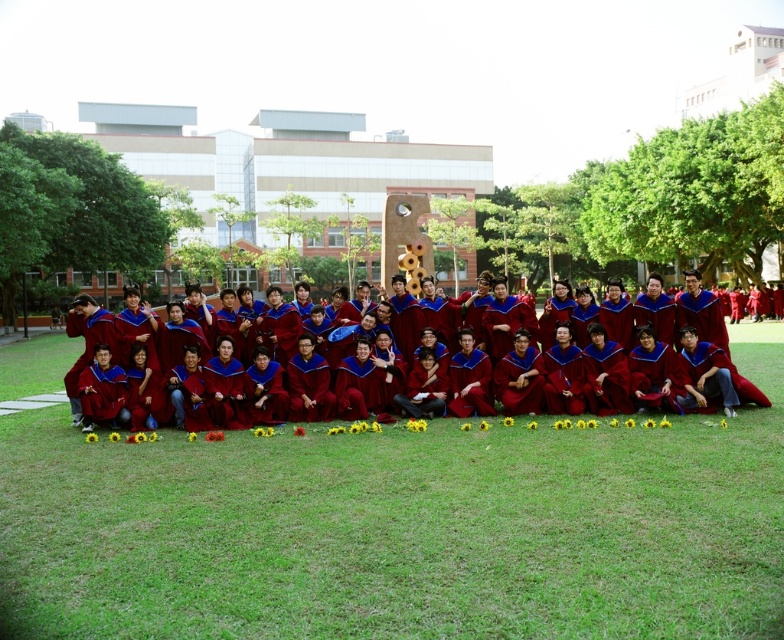
Question: Is green grass at center below maroon velvet graduation gowns at center?

Choices:
 (A) yes
 (B) no

Answer: (A)

Question: Which point is farther from the camera taking this photo?

Choices:
 (A) (750, 340)
 (B) (49, 577)

Answer: (A)

Question: Does green grass at center appear on the right side of maroon velvet graduation gowns at center?

Choices:
 (A) no
 (B) yes

Answer: (A)

Question: Which point is farther from the camera taking this photo?

Choices:
 (A) (731, 333)
 (B) (550, 584)

Answer: (A)

Question: Where is green grass at center located in relation to maroon velvet graduation gowns at center in the image?

Choices:
 (A) left
 (B) right

Answer: (A)

Question: Which object appears closest to the camera in this image?

Choices:
 (A) maroon velvet graduation gowns at center
 (B) green grass at center

Answer: (B)